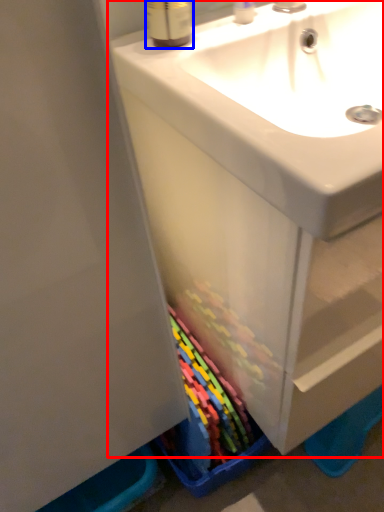
Question: Among these objects, which one is farthest to the camera, bathroom cabinet (highlighted by a red box) or mouthwash (highlighted by a blue box)?

Choices:
 (A) bathroom cabinet
 (B) mouthwash

Answer: (B)